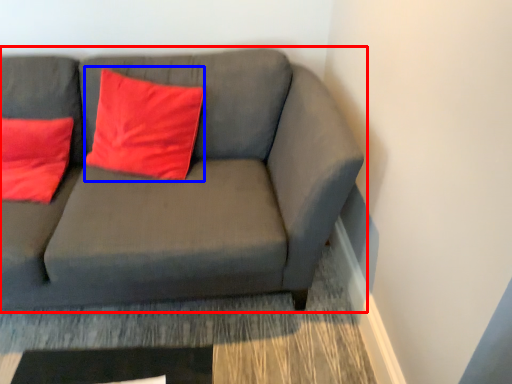
Question: Which of the following is the farthest to the observer, studio couch (highlighted by a red box) or pillow (highlighted by a blue box)?

Choices:
 (A) studio couch
 (B) pillow

Answer: (B)